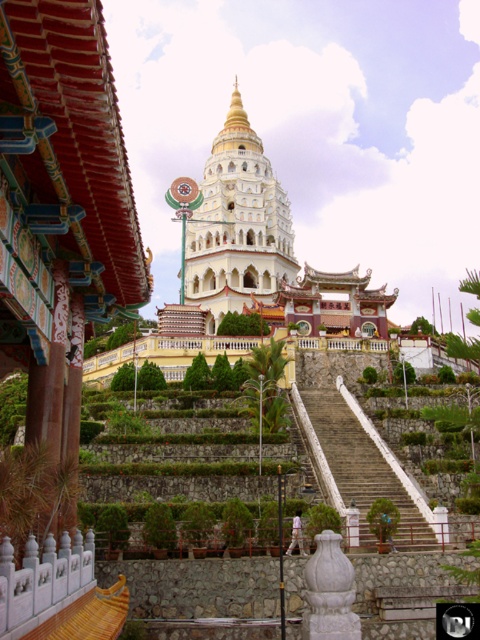
Question: Which point appears farthest from the camera in this image?

Choices:
 (A) (204, 168)
 (B) (333, 464)

Answer: (A)

Question: Which point is closer to the camera taking this photo?

Choices:
 (A) (219, 150)
 (B) (361, 456)

Answer: (B)

Question: Considering the relative positions of white stone pagoda at center and white stone stairs at center in the image provided, where is white stone pagoda at center located with respect to white stone stairs at center?

Choices:
 (A) right
 (B) left

Answer: (B)

Question: Is white stone pagoda at center in front of white stone stairs at center?

Choices:
 (A) yes
 (B) no

Answer: (B)

Question: Is white stone pagoda at center below white stone stairs at center?

Choices:
 (A) yes
 (B) no

Answer: (B)